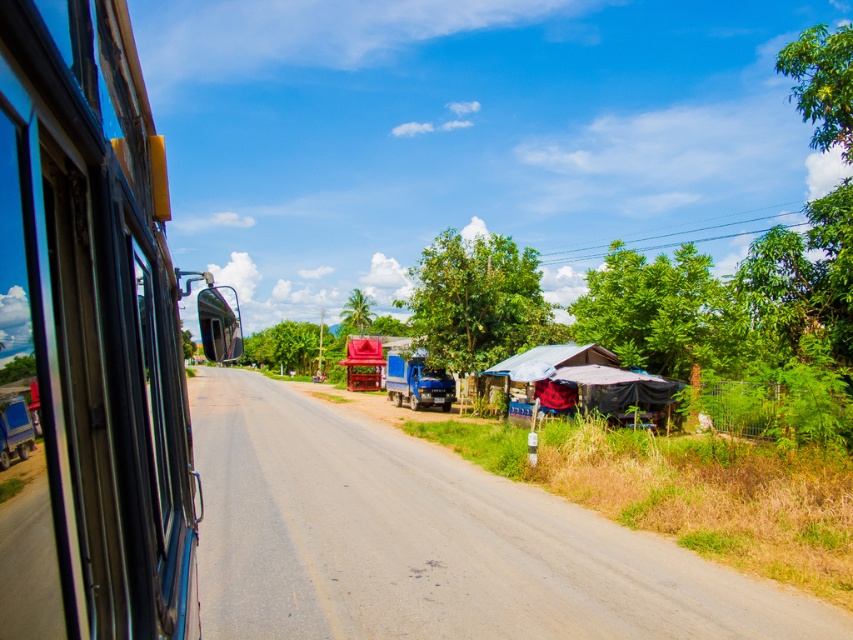
Can you confirm if blue glass train window at left is positioned above rusty corrugated hut at right?

Yes, blue glass train window at left is above rusty corrugated hut at right.

In the scene shown: Can you confirm if blue glass train window at left is positioned below rusty corrugated hut at right?

Actually, blue glass train window at left is above rusty corrugated hut at right.

The height and width of the screenshot is (640, 853). What do you see at coordinates (91, 339) in the screenshot?
I see `blue glass train window at left` at bounding box center [91, 339].

Where is `blue glass train window at left`? This screenshot has width=853, height=640. blue glass train window at left is located at coordinates (91, 339).

Consider the image. Who is taller, brown dirt track at lower right or rusty corrugated hut at right?

rusty corrugated hut at right is taller.

Locate an element on the screen. brown dirt track at lower right is located at coordinates (430, 540).

Does blue glass train window at left appear on the right side of brown dirt track at lower right?

Correct, you'll find blue glass train window at left to the right of brown dirt track at lower right.

Is blue glass train window at left positioned behind brown dirt track at lower right?

No, blue glass train window at left is closer to the viewer.

Where is `blue glass train window at left`? blue glass train window at left is located at coordinates (91, 339).

Where is `blue glass train window at left`? blue glass train window at left is located at coordinates (91, 339).